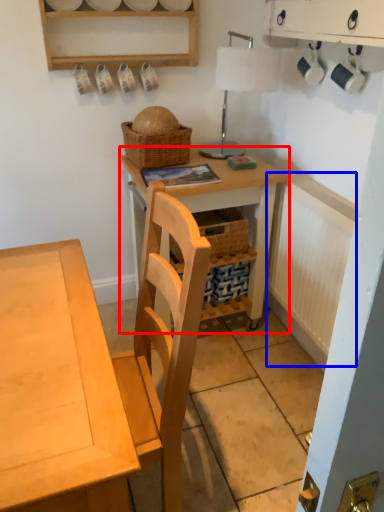
Question: Which object is closer to the camera taking this photo, table (highlighted by a red box) or radiator (highlighted by a blue box)?

Choices:
 (A) table
 (B) radiator

Answer: (B)